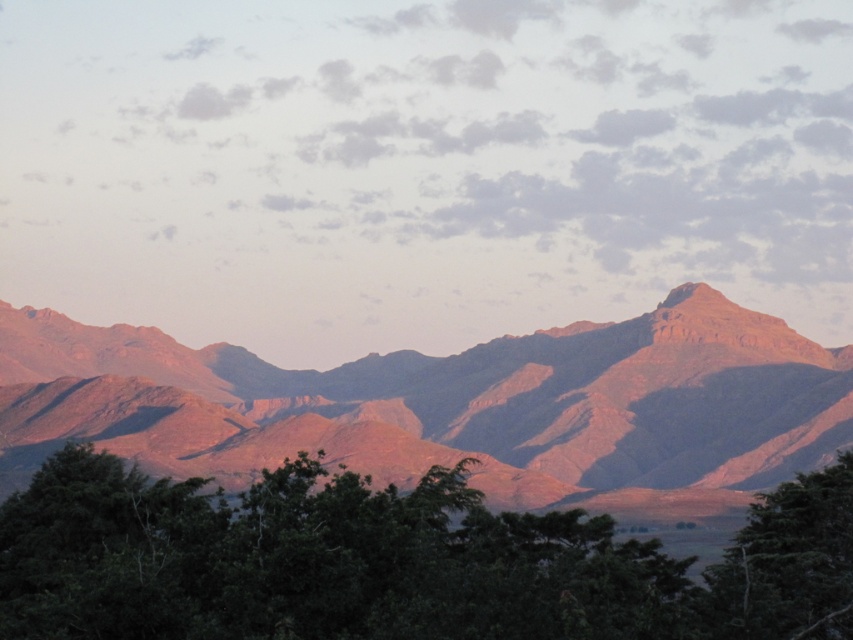
You are standing in the landscape and want to walk towards the green leafy tree at lower right. Which direction should you move relative to the green leafy tree at lower center?

You should move away from the green leafy tree at lower center towards the green leafy tree at lower right since the green leafy tree at lower center is closer to you, meaning the green leafy tree at lower right is further away.